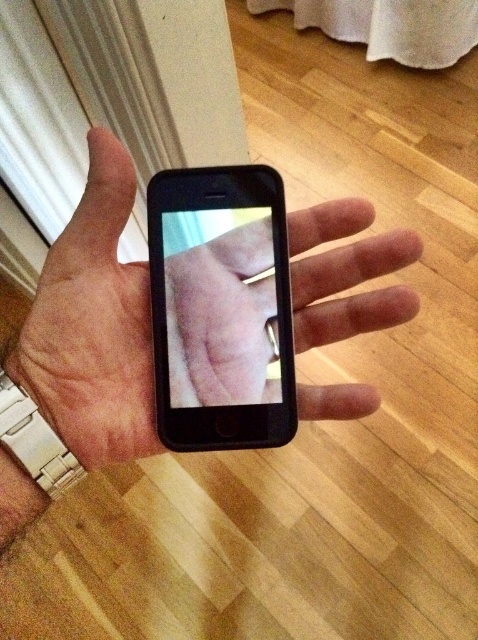
Is point (110, 410) more distant than point (192, 372)?

No.

Between black matte phone at center and black matte smartphone at center, which one is positioned lower?

Positioned lower is black matte smartphone at center.

I want to click on black matte phone at center, so click(93, 324).

You are a GUI agent. You are given a task and a screenshot of the screen. Output one action in this format:
    pyautogui.click(x=<x>, y=<y>)
    Task: Click on the black matte phone at center
    The width and height of the screenshot is (478, 640).
    Given the screenshot: What is the action you would take?
    pyautogui.click(x=93, y=324)